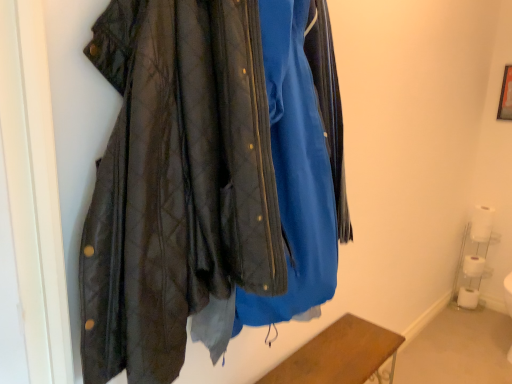
Locate an element on the screen. This screenshot has width=512, height=384. empty space that is ontop of brown wooden table at lower center (from a real-world perspective) is located at coordinates point(340,347).